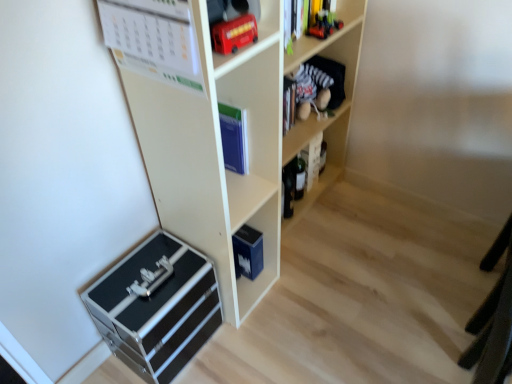
Question: Is metallic red bus at upper center, the first toy viewed from the left, completely or partially outside of velvet plush toy at upper right, which ranks as the third shelf in bottom-to-top order?

Choices:
 (A) no
 (B) yes

Answer: (B)

Question: Is the surface of metallic red bus at upper center, marked as the 1th toy in a bottom-to-top arrangement, in direct contact with velvet plush toy at upper right, the second shelf positioned from the top?

Choices:
 (A) no
 (B) yes

Answer: (A)

Question: From a real-world perspective, is metallic red bus at upper center, the first toy in the front-to-back sequence, located higher than velvet plush toy at upper right, the second shelf positioned from the top?

Choices:
 (A) yes
 (B) no

Answer: (A)

Question: Is metallic red bus at upper center, the first toy viewed from the left, in front of velvet plush toy at upper right, which ranks as the third shelf in bottom-to-top order?

Choices:
 (A) yes
 (B) no

Answer: (A)

Question: Is metallic red bus at upper center, arranged as the 2th toy when viewed from the top, wider than velvet plush toy at upper right, which ranks as the third shelf in bottom-to-top order?

Choices:
 (A) yes
 (B) no

Answer: (B)

Question: From a real-world perspective, is metallic red bus at upper center, arranged as the 2th toy when viewed from the top, physically located above or below white paper calendar at upper left, the 1th book positioned from the left?

Choices:
 (A) above
 (B) below

Answer: (B)

Question: Do you think metallic red bus at upper center, the first toy viewed from the left, is within white paper calendar at upper left, the 1th book positioned from the left, or outside of it?

Choices:
 (A) inside
 (B) outside

Answer: (B)

Question: Considering the positions of metallic red bus at upper center, the first toy viewed from the left, and white paper calendar at upper left, the second book viewed from the right, in the image, is metallic red bus at upper center, the first toy viewed from the left, wider or thinner than white paper calendar at upper left, the second book viewed from the right,?

Choices:
 (A) wide
 (B) thin

Answer: (A)

Question: From the image's perspective, is metallic red bus at upper center, the second toy from the right, positioned above or below white paper calendar at upper left, the first book from the front?

Choices:
 (A) below
 (B) above

Answer: (B)

Question: Relative to metallic red toy car at upper right, marked as the 1th toy in a top-to-bottom arrangement, is black metallic toolbox at lower left, which appears as the 4th shelf when viewed from the top, in front or behind?

Choices:
 (A) front
 (B) behind

Answer: (A)

Question: From a real-world perspective, is black metallic toolbox at lower left, which appears as the 4th shelf when viewed from the top, positioned above or below metallic red toy car at upper right, the 2th toy positioned from the front?

Choices:
 (A) below
 (B) above

Answer: (A)

Question: In terms of height, does black metallic toolbox at lower left, the first shelf when ordered from bottom to top, look taller or shorter compared to metallic red toy car at upper right, which appears as the 1th toy when viewed from the back?

Choices:
 (A) tall
 (B) short

Answer: (A)

Question: Looking at the image, does black metallic toolbox at lower left, the first shelf when ordered from bottom to top, seem bigger or smaller compared to metallic red toy car at upper right, the 2th toy positioned from the front?

Choices:
 (A) small
 (B) big

Answer: (B)

Question: Looking at their shapes, would you say matte black book at center right, the 2th book positioned from the left, is wider or thinner than metallic red toy car at upper right, which appears as the 1th toy when viewed from the back?

Choices:
 (A) thin
 (B) wide

Answer: (A)

Question: From the image's perspective, is matte black book at center right, acting as the second book starting from the front, positioned above or below metallic red toy car at upper right, the 2th toy ordered from the bottom?

Choices:
 (A) above
 (B) below

Answer: (B)